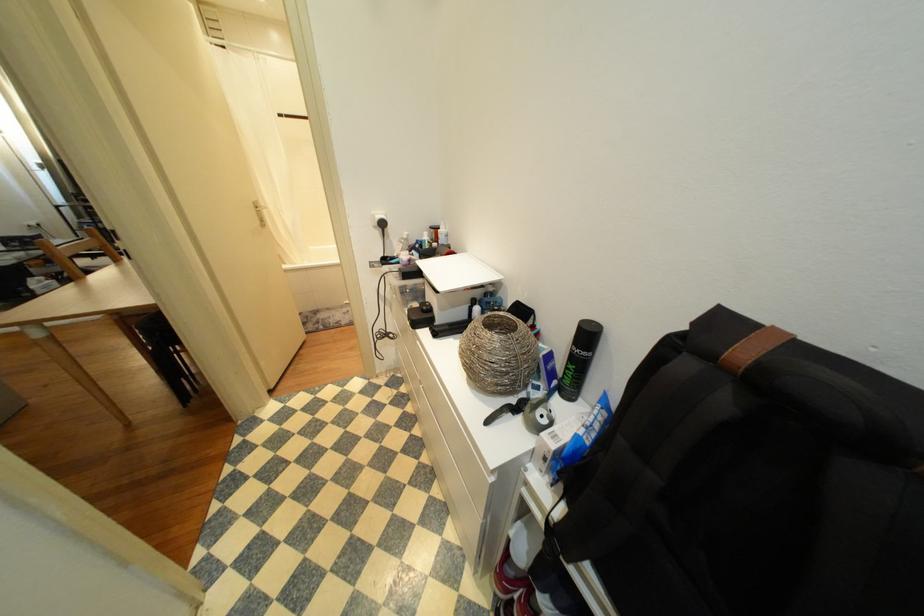
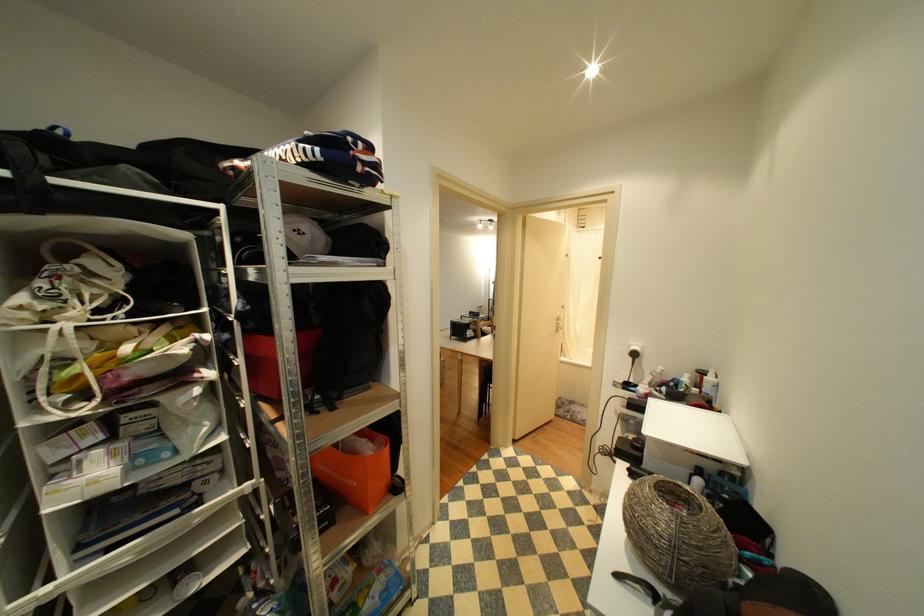
Question: The camera is either moving clockwise (left) or counter-clockwise (right) around the object. The first image is from the beginning of the video and the second image is from the end. Is the camera moving left or right when shooting the video?

Choices:
 (A) Left
 (B) Right

Answer: (B)